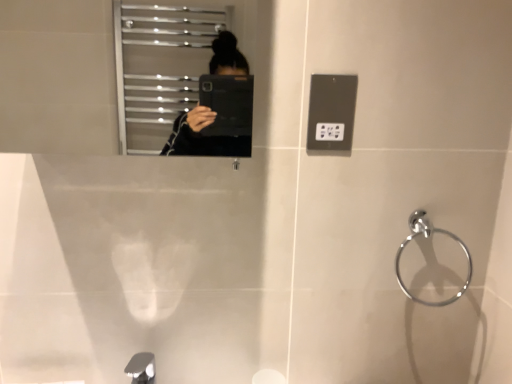
Question: Is silver metallic tap at lower left at the back of chrome metallic towel ring at right?

Choices:
 (A) no
 (B) yes

Answer: (A)

Question: Is chrome metallic towel ring at right further to camera compared to silver metallic tap at lower left?

Choices:
 (A) no
 (B) yes

Answer: (B)

Question: Can you confirm if chrome metallic towel ring at right is positioned to the left of silver metallic tap at lower left?

Choices:
 (A) yes
 (B) no

Answer: (B)

Question: From the image's perspective, is chrome metallic towel ring at right under silver metallic tap at lower left?

Choices:
 (A) yes
 (B) no

Answer: (B)

Question: Is chrome metallic towel ring at right aimed at silver metallic tap at lower left?

Choices:
 (A) no
 (B) yes

Answer: (A)

Question: Considering the relative positions of chrome metallic towel ring at right and silver metallic tap at lower left in the image provided, is chrome metallic towel ring at right in front of silver metallic tap at lower left?

Choices:
 (A) yes
 (B) no

Answer: (B)

Question: Can you confirm if chrome metallic towel ring at right is shorter than metallic gray outlet at upper right?

Choices:
 (A) no
 (B) yes

Answer: (A)

Question: Is chrome metallic towel ring at right bigger than metallic gray outlet at upper right?

Choices:
 (A) no
 (B) yes

Answer: (B)

Question: Are chrome metallic towel ring at right and metallic gray outlet at upper right making contact?

Choices:
 (A) no
 (B) yes

Answer: (A)

Question: Is chrome metallic towel ring at right not close to metallic gray outlet at upper right?

Choices:
 (A) no
 (B) yes

Answer: (A)

Question: Can metallic gray outlet at upper right be found inside chrome metallic towel ring at right?

Choices:
 (A) yes
 (B) no

Answer: (B)

Question: Is chrome metallic towel ring at right positioned with its back to metallic gray outlet at upper right?

Choices:
 (A) no
 (B) yes

Answer: (A)

Question: From the image's perspective, is silver metallic tap at lower left over chrome metallic towel ring at right?

Choices:
 (A) yes
 (B) no

Answer: (B)